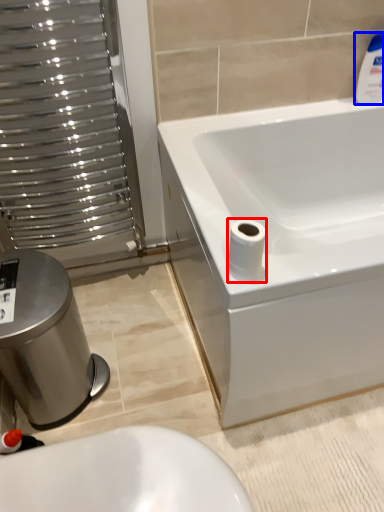
Question: Which object appears farthest to the camera in this image, toilet paper (highlighted by a red box) or cleaning product (highlighted by a blue box)?

Choices:
 (A) toilet paper
 (B) cleaning product

Answer: (B)